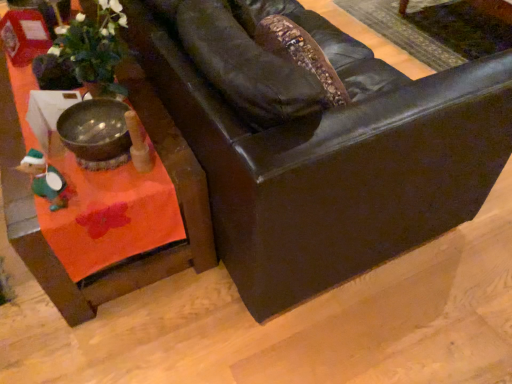
What do you see at coordinates (44, 179) in the screenshot? This screenshot has width=512, height=384. I see `green felt toy at lower left` at bounding box center [44, 179].

I want to click on green felt toy at lower left, so click(x=44, y=179).

Is matte black leather couch at center not close to green felt toy at lower left?

matte black leather couch at center is actually quite close to green felt toy at lower left.

Which object is positioned more to the right, matte black leather couch at center or green felt toy at lower left?

matte black leather couch at center.

Can we say matte black leather couch at center lies outside green felt toy at lower left?

matte black leather couch at center is positioned outside green felt toy at lower left.

Does point (431, 179) appear closer or farther from the camera than point (42, 197)?

Point (431, 179).

Is point (64, 184) closer or farther from the camera than point (8, 139)?

Point (64, 184) appears to be closer to the viewer than point (8, 139).

Can we say green felt toy at lower left lies outside orange fabric table at lower left?

green felt toy at lower left is positioned outside orange fabric table at lower left.

Would you say green felt toy at lower left is to the left or to the right of orange fabric table at lower left in the picture?

green felt toy at lower left is to the right of orange fabric table at lower left.

Who is bigger, green felt toy at lower left or orange fabric table at lower left?

orange fabric table at lower left.

Between matte black leather couch at center and orange fabric table at lower left, which one is positioned in front?

matte black leather couch at center.

Considering the relative positions of matte black leather couch at center and orange fabric table at lower left in the image provided, is matte black leather couch at center to the left of orange fabric table at lower left from the viewer's perspective?

No, matte black leather couch at center is not to the left of orange fabric table at lower left.

Consider the image. From a real-world perspective, is matte black leather couch at center positioned under orange fabric table at lower left based on gravity?

No, from a real-world perspective, matte black leather couch at center is not below orange fabric table at lower left.

Which is farther, (40, 183) or (314, 145)?

The point (40, 183) is more distant.

Considering the positions of objects green felt toy at lower left and matte black leather couch at center in the image provided, who is more to the right, green felt toy at lower left or matte black leather couch at center?

matte black leather couch at center.

Is green felt toy at lower left not close to matte black leather couch at center?

green felt toy at lower left is actually quite close to matte black leather couch at center.

From the image's perspective, which one is positioned lower, green felt toy at lower left or matte black leather couch at center?

green felt toy at lower left is shown below in the image.

Considering the positions of objects orange fabric table at lower left and matte black leather couch at center in the image provided, who is more to the left, orange fabric table at lower left or matte black leather couch at center?

orange fabric table at lower left is more to the left.

From the image's perspective, is orange fabric table at lower left under matte black leather couch at center?

Indeed, from the image's perspective, orange fabric table at lower left is shown beneath matte black leather couch at center.

Is orange fabric table at lower left not inside matte black leather couch at center?

Absolutely, orange fabric table at lower left is external to matte black leather couch at center.

From a real-world perspective, which object rests below the other?

orange fabric table at lower left is physically lower.

Where is `table lying on the left of green felt toy at lower left`? The width and height of the screenshot is (512, 384). table lying on the left of green felt toy at lower left is located at coordinates click(x=130, y=258).

Is orange fabric table at lower left aimed at green felt toy at lower left?

No, orange fabric table at lower left is not turned towards green felt toy at lower left.

Based on the photo, from a real-world perspective, is orange fabric table at lower left above or below green felt toy at lower left?

From a real-world perspective, orange fabric table at lower left is physically below green felt toy at lower left.

You are a GUI agent. You are given a task and a screenshot of the screen. Output one action in this format:
    pyautogui.click(x=<x>, y=<y>)
    Task: Click on the chair on the right side of green felt toy at lower left
    
    Given the screenshot: What is the action you would take?
    pyautogui.click(x=334, y=170)

Where is `table above the green felt toy at lower left (from the image's perspective)`? The height and width of the screenshot is (384, 512). table above the green felt toy at lower left (from the image's perspective) is located at coordinates (130, 258).

When comparing their distances from orange fabric table at lower left, does matte black leather couch at center or green felt toy at lower left seem further?

The object further to orange fabric table at lower left is matte black leather couch at center.

Considering their positions, is orange fabric table at lower left positioned further to green felt toy at lower left than matte black leather couch at center?

Among the two, matte black leather couch at center is located further to green felt toy at lower left.

When comparing their distances from orange fabric table at lower left, does green felt toy at lower left or matte black leather couch at center seem further?

matte black leather couch at center is positioned further to the anchor orange fabric table at lower left.

Based on their spatial positions, is green felt toy at lower left or orange fabric table at lower left further from matte black leather couch at center?

Among the two, green felt toy at lower left is located further to matte black leather couch at center.

Estimate the real-world distances between objects in this image. Which object is further from matte black leather couch at center, orange fabric table at lower left or green felt toy at lower left?

Among the two, green felt toy at lower left is located further to matte black leather couch at center.

Based on their spatial positions, is matte black leather couch at center or orange fabric table at lower left closer to green felt toy at lower left?

orange fabric table at lower left.

The image size is (512, 384). I want to click on toy between orange fabric table at lower left and matte black leather couch at center, so click(44, 179).